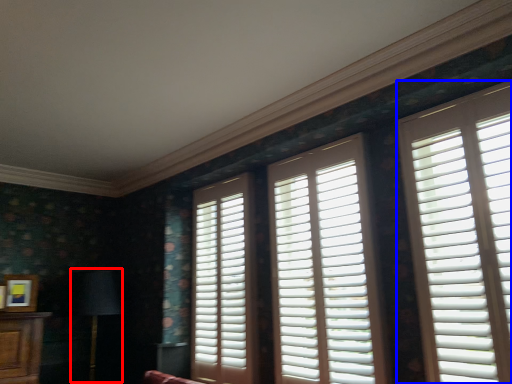
Question: Which of the following is the farthest to the observer, table lamp (highlighted by a red box) or window (highlighted by a blue box)?

Choices:
 (A) table lamp
 (B) window

Answer: (A)